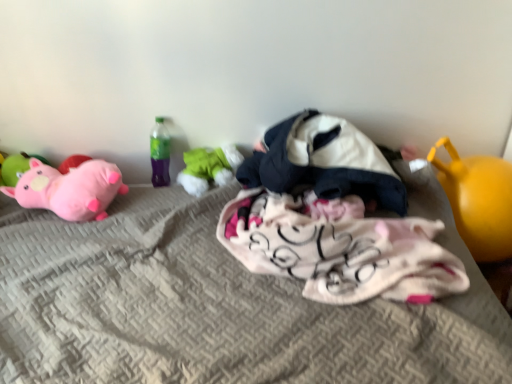
Question: Is yellow rubber ball at right, which is counted as the 1th toy, starting from the right, taller than white soft blanket at center, which is counted as the fourth toy, starting from the left?

Choices:
 (A) yes
 (B) no

Answer: (A)

Question: Is yellow rubber ball at right, acting as the fifth toy starting from the left, directly adjacent to white soft blanket at center, placed as the 2th toy when sorted from right to left?

Choices:
 (A) yes
 (B) no

Answer: (B)

Question: From a real-world perspective, is yellow rubber ball at right, acting as the fifth toy starting from the left, located higher than white soft blanket at center, which is counted as the fourth toy, starting from the left?

Choices:
 (A) yes
 (B) no

Answer: (B)

Question: Is yellow rubber ball at right, which is counted as the 1th toy, starting from the right, positioned beyond the bounds of white soft blanket at center, placed as the 2th toy when sorted from right to left?

Choices:
 (A) no
 (B) yes

Answer: (B)

Question: Is yellow rubber ball at right, which is counted as the 1th toy, starting from the right, facing towards white soft blanket at center, which is counted as the fourth toy, starting from the left?

Choices:
 (A) yes
 (B) no

Answer: (B)

Question: Is green fabric toy at center, the 3th toy in the right-to-left sequence, inside the boundaries of pink plush pig at left, which is the first toy in left-to-right order, or outside?

Choices:
 (A) outside
 (B) inside

Answer: (A)

Question: In the image, is green fabric toy at center, the 3th toy in the right-to-left sequence, positioned in front of or behind pink plush pig at left, which is the first toy in left-to-right order?

Choices:
 (A) behind
 (B) front

Answer: (B)

Question: In terms of width, does green fabric toy at center, the third toy when ordered from left to right, look wider or thinner when compared to pink plush pig at left, the 5th toy in the right-to-left sequence?

Choices:
 (A) wide
 (B) thin

Answer: (A)

Question: From the image's perspective, is green fabric toy at center, the third toy when ordered from left to right, located above or below pink plush pig at left, which is the first toy in left-to-right order?

Choices:
 (A) below
 (B) above

Answer: (A)

Question: Choose the correct answer: Is green fabric toy at center, the 3th toy in the right-to-left sequence, inside textured gray mattress at center or outside it?

Choices:
 (A) inside
 (B) outside

Answer: (A)

Question: From the image's perspective, is green fabric toy at center, the third toy when ordered from left to right, above or below textured gray mattress at center?

Choices:
 (A) above
 (B) below

Answer: (A)

Question: Does point (211, 177) appear closer or farther from the camera than point (280, 332)?

Choices:
 (A) farther
 (B) closer

Answer: (A)

Question: Looking at their shapes, would you say green fabric toy at center, the third toy when ordered from left to right, is wider or thinner than textured gray mattress at center?

Choices:
 (A) thin
 (B) wide

Answer: (A)

Question: Is point (65, 216) closer or farther from the camera than point (325, 147)?

Choices:
 (A) farther
 (B) closer

Answer: (B)

Question: Is matte pink plush at left, acting as the 2th toy starting from the left, wider or thinner than white soft blanket at center, placed as the 2th toy when sorted from right to left?

Choices:
 (A) wide
 (B) thin

Answer: (B)